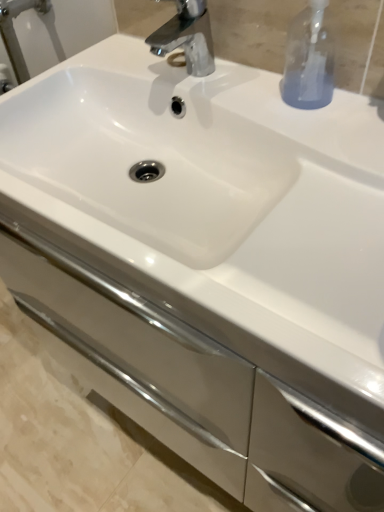
I want to click on transparent glass soap dispenser at upper right, so click(309, 60).

Describe the element at coordinates (195, 385) in the screenshot. This screenshot has width=384, height=512. I see `white glossy cabinet at center` at that location.

What are the coordinates of `polished chrome faucet at upper center` in the screenshot? It's located at (187, 37).

Considering the relative positions of white glossy cabinet at center and transparent glass soap dispenser at upper right in the image provided, is white glossy cabinet at center in front of transparent glass soap dispenser at upper right?

Yes, it is.

Is there a large distance between white glossy cabinet at center and transparent glass soap dispenser at upper right?

white glossy cabinet at center is actually quite close to transparent glass soap dispenser at upper right.

What's the angular difference between white glossy cabinet at center and transparent glass soap dispenser at upper right's facing directions?

The angular difference between white glossy cabinet at center and transparent glass soap dispenser at upper right is 0.664 degrees.

From a real-world perspective, who is located higher, white glossy cabinet at center or transparent glass soap dispenser at upper right?

From a 3D spatial view, transparent glass soap dispenser at upper right is above.

From the image's perspective, who appears lower, polished chrome faucet at upper center or transparent glass soap dispenser at upper right?

transparent glass soap dispenser at upper right is shown below in the image.

From the picture: Does polished chrome faucet at upper center lie behind transparent glass soap dispenser at upper right?

Yes, polished chrome faucet at upper center is further from the viewer.

Is transparent glass soap dispenser at upper right completely or partially inside polished chrome faucet at upper center?

No.

Consider the image. Is polished chrome faucet at upper center aimed at transparent glass soap dispenser at upper right?

No.

Considering the sizes of transparent glass soap dispenser at upper right and polished chrome faucet at upper center in the image, is transparent glass soap dispenser at upper right bigger or smaller than polished chrome faucet at upper center?

In the image, transparent glass soap dispenser at upper right appears to be smaller than polished chrome faucet at upper center.

What's the angular difference between transparent glass soap dispenser at upper right and polished chrome faucet at upper center's facing directions?

There is a 0.326-degree angle between the facing directions of transparent glass soap dispenser at upper right and polished chrome faucet at upper center.

Would you say transparent glass soap dispenser at upper right is a long distance from polished chrome faucet at upper center?

Actually, transparent glass soap dispenser at upper right and polished chrome faucet at upper center are a little close together.

From a real-world perspective, does transparent glass soap dispenser at upper right stand above polished chrome faucet at upper center?

Yes, from a real-world perspective, transparent glass soap dispenser at upper right is above polished chrome faucet at upper center.

Is transparent glass soap dispenser at upper right in front of or behind white glossy cabinet at center in the image?

In the image, transparent glass soap dispenser at upper right appears behind white glossy cabinet at center.

Locate an element on the screen. Image resolution: width=384 pixels, height=512 pixels. soap dispenser lying behind the white glossy cabinet at center is located at coordinates (309, 60).

Could you tell me if transparent glass soap dispenser at upper right is facing white glossy cabinet at center?

No, transparent glass soap dispenser at upper right does not turn towards white glossy cabinet at center.

From the image's perspective, is transparent glass soap dispenser at upper right under white glossy cabinet at center?

No.

Do you think white glossy cabinet at center is within polished chrome faucet at upper center, or outside of it?

The correct answer is: outside.

In the scene shown: From the image's perspective, is white glossy cabinet at center below polished chrome faucet at upper center?

Indeed, from the image's perspective, white glossy cabinet at center is shown beneath polished chrome faucet at upper center.

In the image, is white glossy cabinet at center positioned in front of or behind polished chrome faucet at upper center?

In the image, white glossy cabinet at center appears in front of polished chrome faucet at upper center.

Is polished chrome faucet at upper center to the left of white glossy cabinet at center from the viewer's perspective?

Correct, you'll find polished chrome faucet at upper center to the left of white glossy cabinet at center.

Measure the distance between polished chrome faucet at upper center and white glossy cabinet at center.

22.08 inches.

Between polished chrome faucet at upper center and white glossy cabinet at center, which one has larger size?

With larger size is white glossy cabinet at center.

Is there a large distance between polished chrome faucet at upper center and white glossy cabinet at center?

That's not correct — polished chrome faucet at upper center is a little close to white glossy cabinet at center.

The width and height of the screenshot is (384, 512). I want to click on bathroom cabinet below the transparent glass soap dispenser at upper right (from a real-world perspective), so click(195, 385).

This screenshot has height=512, width=384. I want to click on tap that is on the left side of transparent glass soap dispenser at upper right, so tap(187, 37).

Looking at the image, which one is located closer to white glossy cabinet at center, transparent glass soap dispenser at upper right or polished chrome faucet at upper center?

transparent glass soap dispenser at upper right lies closer to white glossy cabinet at center than the other object.

From the image, which object appears to be farther from white glossy cabinet at center, polished chrome faucet at upper center or transparent glass soap dispenser at upper right?

Based on the image, polished chrome faucet at upper center appears to be further to white glossy cabinet at center.

Which object lies nearer to the anchor point polished chrome faucet at upper center, white glossy cabinet at center or transparent glass soap dispenser at upper right?

transparent glass soap dispenser at upper right lies closer to polished chrome faucet at upper center than the other object.

Looking at the image, which one is located further to transparent glass soap dispenser at upper right, polished chrome faucet at upper center or white glossy cabinet at center?

white glossy cabinet at center.

Based on their spatial positions, is white glossy cabinet at center or polished chrome faucet at upper center closer to transparent glass soap dispenser at upper right?

polished chrome faucet at upper center lies closer to transparent glass soap dispenser at upper right than the other object.

Which object lies further to the anchor point polished chrome faucet at upper center, transparent glass soap dispenser at upper right or white glossy cabinet at center?

Based on the image, white glossy cabinet at center appears to be further to polished chrome faucet at upper center.

Locate an element on the screen. soap dispenser between polished chrome faucet at upper center and white glossy cabinet at center in the vertical direction is located at coordinates (309, 60).